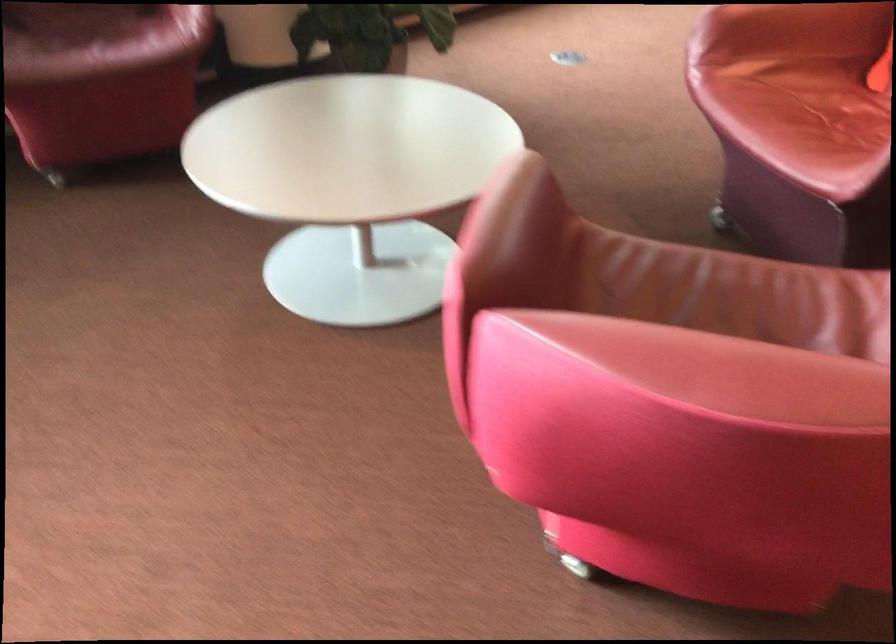
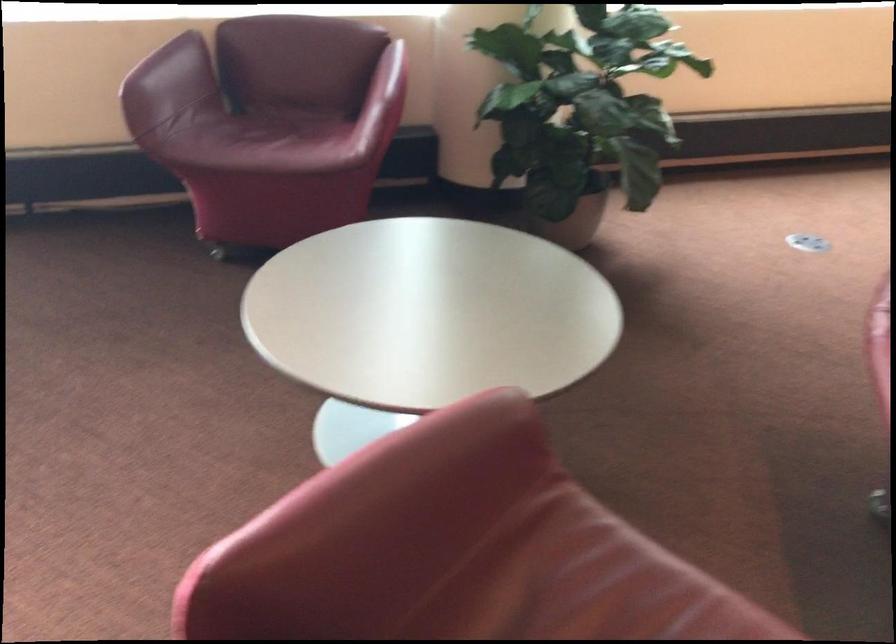
In a continuous first-person perspective shot, in which direction is the camera moving?

The cameraman walked toward right, forward.